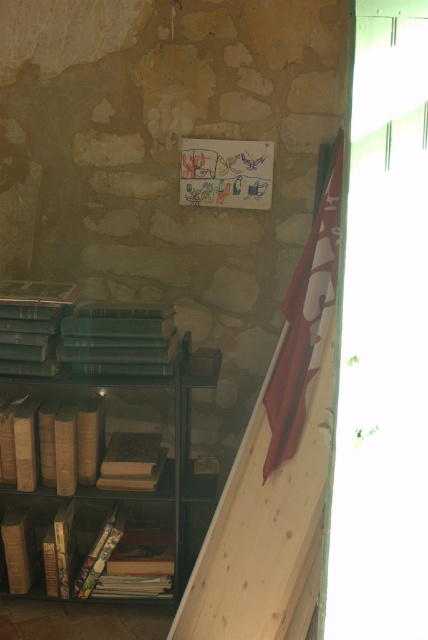
You are an interior designer who needs to ensure that the brown leather bookcase at lower left and the red fabric flag at upper right are proportionally balanced in the room. Considering their sizes, which object might require more space in the room?

The brown leather bookcase at lower left has a larger size compared to the red fabric flag at upper right, so it requires more space in the room.

You are standing in the room depicted in the scene. There is a point marked at coordinates [91,435]. What object is located at this point?

The brown leather bookcase at lower left is located at point [91,435].